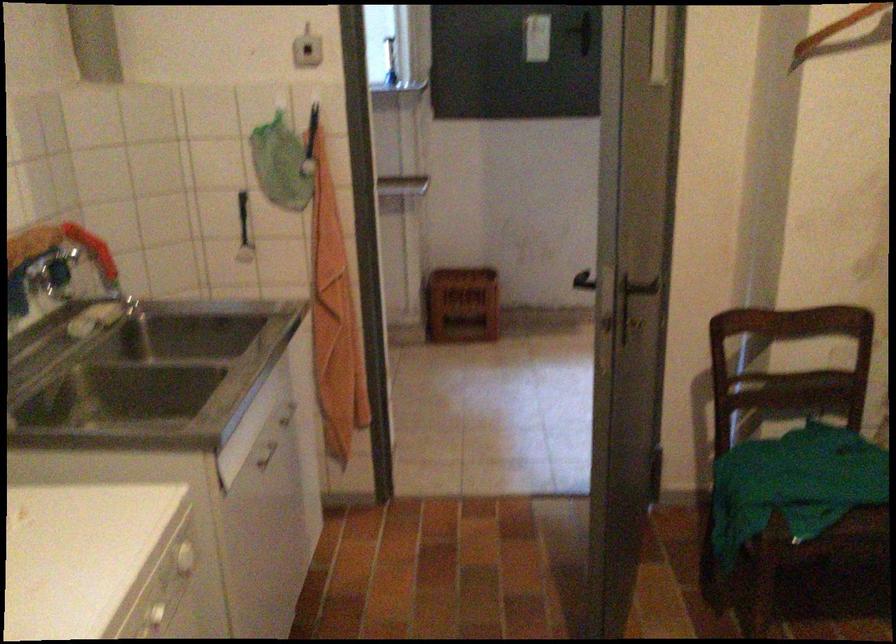
This screenshot has width=896, height=644. In order to click on wooden crate in this screenshot , I will do `click(462, 305)`.